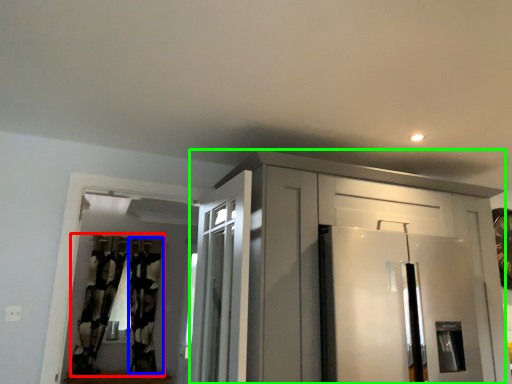
Question: Based on their relative distances, which object is farther from curtain (highlighted by a red box)? Choose from curtain (highlighted by a blue box) and cabinetry (highlighted by a green box).

Choices:
 (A) curtain
 (B) cabinetry

Answer: (B)